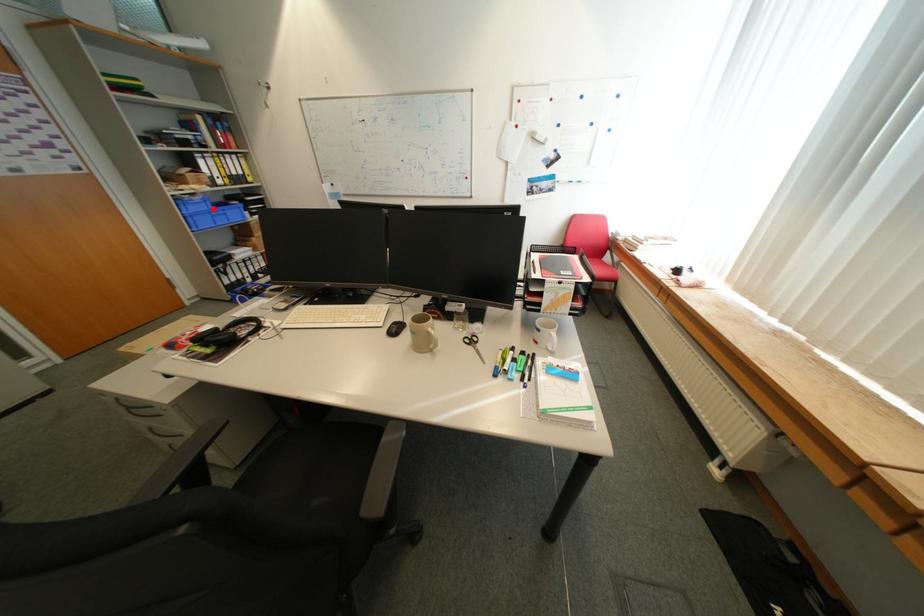
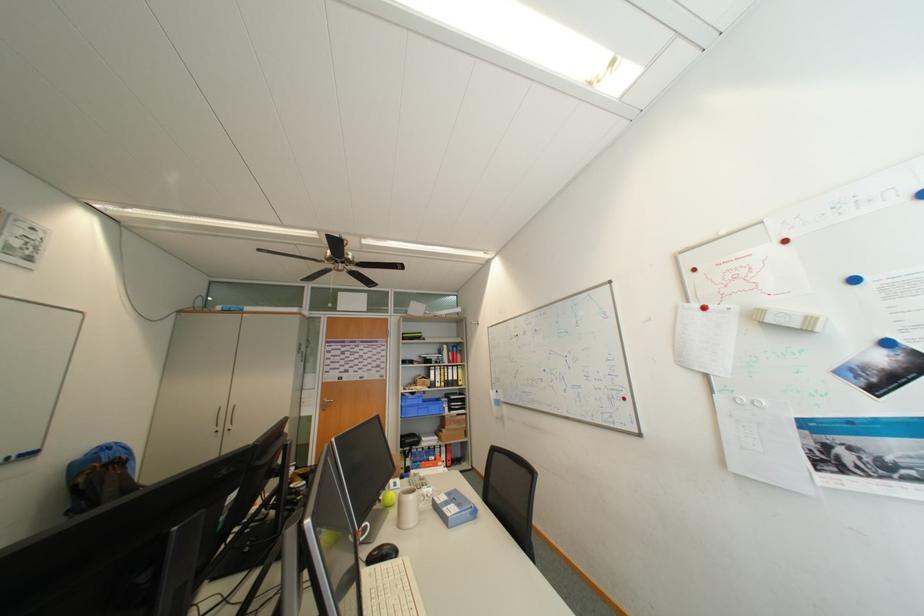
Question: A red point is marked in image1. In image2, is the corresponding 3D point closer to the camera or farther? Reply with the corresponding letter.

Choices:
 (A) The corresponding 3D point is closer.
 (B) The corresponding 3D point is farther.

Answer: (B)